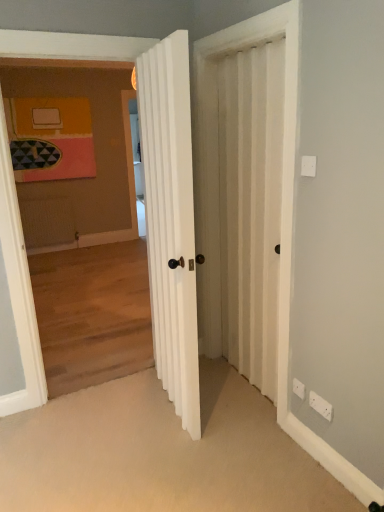
Question: Should I look upward or downward to see white ribbed door at center?

Choices:
 (A) up
 (B) down

Answer: (A)

Question: Is white ribbed door at center turned away from white plastic electric outlet at lower right, which appears as the second electric outlet when viewed from the back?

Choices:
 (A) no
 (B) yes

Answer: (A)

Question: Considering the relative sizes of white ribbed door at center and white plastic electric outlet at lower right, which appears as the second electric outlet when viewed from the back, in the image provided, is white ribbed door at center smaller than white plastic electric outlet at lower right, which appears as the second electric outlet when viewed from the back,?

Choices:
 (A) yes
 (B) no

Answer: (B)

Question: From the image's perspective, is white ribbed door at center below white plastic electric outlet at lower right, the second electric outlet when ordered from left to right?

Choices:
 (A) no
 (B) yes

Answer: (A)

Question: Is white ribbed door at center not near white plastic electric outlet at lower right, which appears as the second electric outlet when viewed from the back?

Choices:
 (A) yes
 (B) no

Answer: (A)

Question: Considering the relative positions of white ribbed door at center and white plastic electric outlet at lower right, acting as the 1th electric outlet starting from the right, in the image provided, is white ribbed door at center to the right of white plastic electric outlet at lower right, acting as the 1th electric outlet starting from the right, from the viewer's perspective?

Choices:
 (A) yes
 (B) no

Answer: (B)

Question: From a real-world perspective, is white ribbed door at center over white plastic electric outlet at lower right, the second electric outlet when ordered from left to right?

Choices:
 (A) no
 (B) yes

Answer: (B)

Question: From the image's perspective, does white plastic electric outlet at lower right, the second electric outlet when ordered from left to right, appear higher than white textured screen door at center?

Choices:
 (A) yes
 (B) no

Answer: (B)

Question: Is white plastic electric outlet at lower right, acting as the 1th electric outlet starting from the right, closer to the viewer compared to white textured screen door at center?

Choices:
 (A) yes
 (B) no

Answer: (B)

Question: From a real-world perspective, is white plastic electric outlet at lower right, the second electric outlet when ordered from left to right, below white textured screen door at center?

Choices:
 (A) no
 (B) yes

Answer: (B)

Question: Can you confirm if white plastic electric outlet at lower right, the second electric outlet when ordered from left to right, is bigger than white textured screen door at center?

Choices:
 (A) yes
 (B) no

Answer: (B)

Question: Is white plastic electric outlet at lower right, the second electric outlet when ordered from left to right, oriented away from white textured screen door at center?

Choices:
 (A) yes
 (B) no

Answer: (B)

Question: Can you confirm if white plastic electric outlet at lower right, acting as the 1th electric outlet starting from the right, is smaller than white textured screen door at center?

Choices:
 (A) no
 (B) yes

Answer: (B)

Question: Is white ribbed door at center oriented away from white plastic electric outlet at lower right, acting as the 2th electric outlet starting from the front?

Choices:
 (A) no
 (B) yes

Answer: (A)